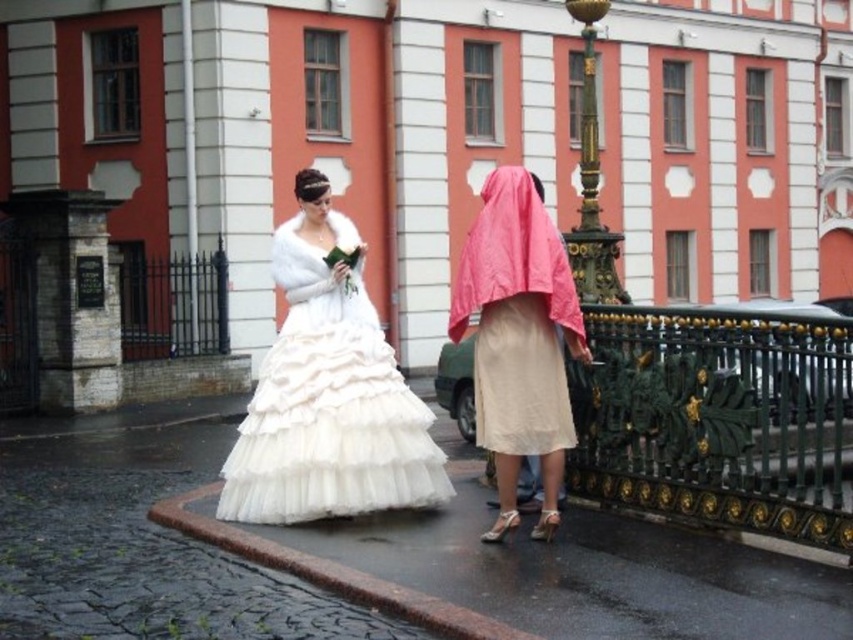
You are a photographer planning to capture a wide shot of the scene. Given that the white tulle dress at center and the gold polished metal lamp post at upper center are both in the frame, can you determine which object is narrower?

The white tulle dress at center is narrower than the gold polished metal lamp post at upper center.

You are a photographer standing on the cobblestone street. You want to take a photo of the white tulle dress at center and the gold polished metal lamp post at upper center. Based on their positions, which object is closer to the camera?

The white tulle dress at center is located below the gold polished metal lamp post at upper center, so the dress is closer to the camera than the lamp post.

You are standing at the point marked as point (718,419) in the image. What object is located at this point?

The green wrought iron fence at lower right is located at point (718,419).